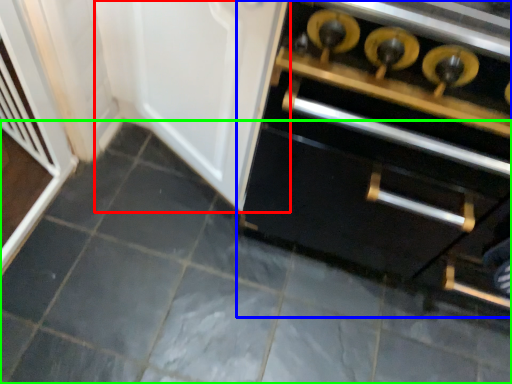
Question: Which is farther away from door (highlighted by a red box)? cabinetry (highlighted by a blue box) or ceramic tile (highlighted by a green box)?

Choices:
 (A) cabinetry
 (B) ceramic tile

Answer: (B)